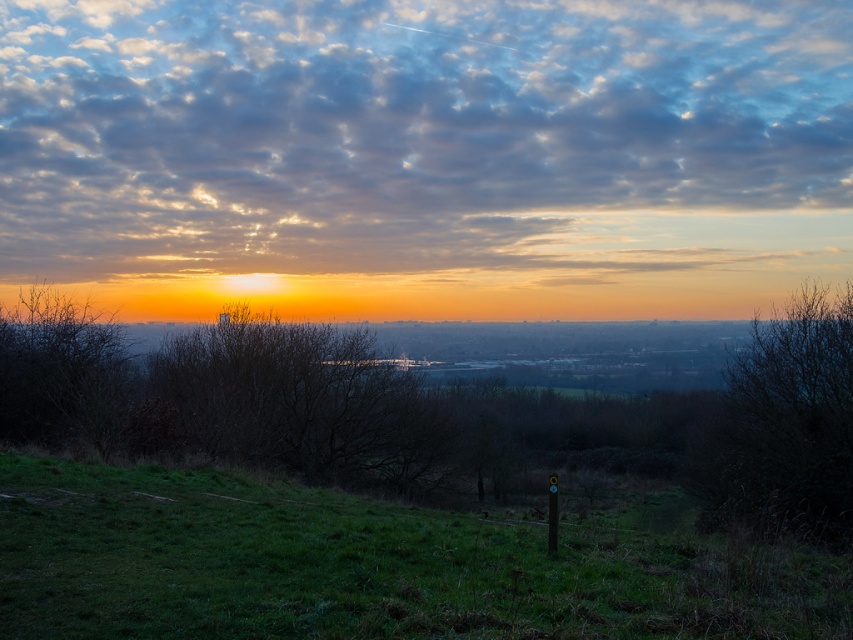
You are standing in the middle of the grassy area and want to walk towards the tree. Which direction should you move to reach the brown textured tree at center from the green grassy at lower center?

To reach the brown textured tree at center from the green grassy at lower center, you should move to the left since the green grassy at lower center is to the right of the tree.